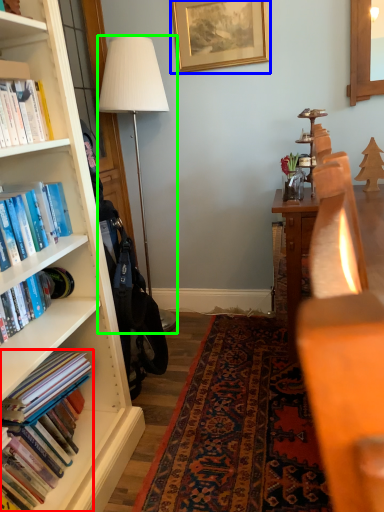
Question: Which is farther away from book (highlighted by a red box)? picture frame (highlighted by a blue box) or lamp (highlighted by a green box)?

Choices:
 (A) picture frame
 (B) lamp

Answer: (A)